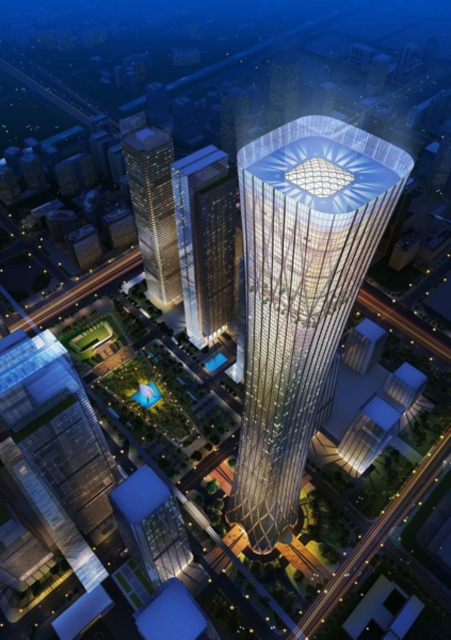
Can you confirm if transparent glass skyscraper at center is positioned above gold glass skyscraper at left?

Actually, transparent glass skyscraper at center is below gold glass skyscraper at left.

Does point (188, 292) come closer to viewer compared to point (141, 176)?

That is False.

Which is behind, point (202, 296) or point (161, 301)?

Positioned behind is point (161, 301).

The height and width of the screenshot is (640, 451). Identify the location of transparent glass skyscraper at center. (205, 241).

Measure the distance between gold glass tower at center and gold glass skyscraper at left.

gold glass tower at center and gold glass skyscraper at left are 208.72 meters apart from each other.

Is point (377, 230) closer to viewer compared to point (164, 307)?

Yes, point (377, 230) is closer to viewer.

Is point (337, 179) behind point (156, 248)?

No, it is in front of (156, 248).

Identify the location of gold glass tower at center. click(300, 292).

Is gold glass tower at center above transparent glass skyscraper at center?

No, gold glass tower at center is not above transparent glass skyscraper at center.

How much distance is there between gold glass tower at center and transparent glass skyscraper at center?

gold glass tower at center and transparent glass skyscraper at center are 511.40 feet apart.

Which is in front, point (354, 268) or point (192, 288)?

Point (354, 268) is in front.

Find the location of a particular element. gold glass tower at center is located at coordinates (300, 292).